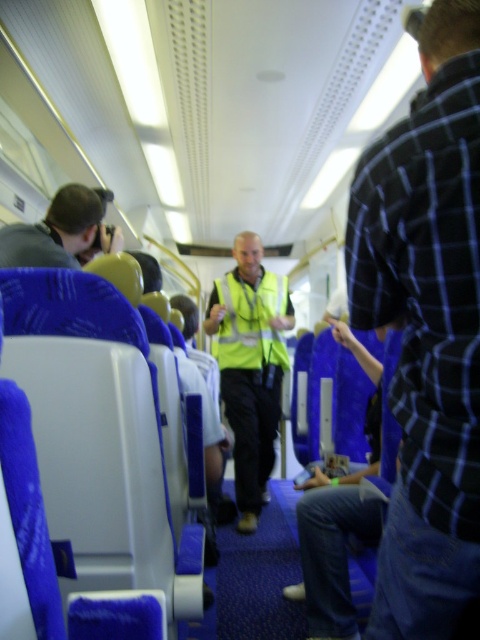
From the picture: You are a passenger sitting in the train and want to reach the point at coordinates (410,113). If your arm can reach 30 inches, can you touch that point without standing up?

The point at coordinates (410,113) is 33.51 inches away from the viewer, which is beyond your arm reach of 30 inches. You cannot touch it without standing up.

You are a passenger on the train and want to know if the plaid shirt at right is covering the high visibility yellow vest at center from your viewpoint. Based on the scene description, can you determine this?

The plaid shirt at right is positioned over the high visibility yellow vest at center, so yes, the plaid shirt at right is covering the high visibility yellow vest at center from your viewpoint.